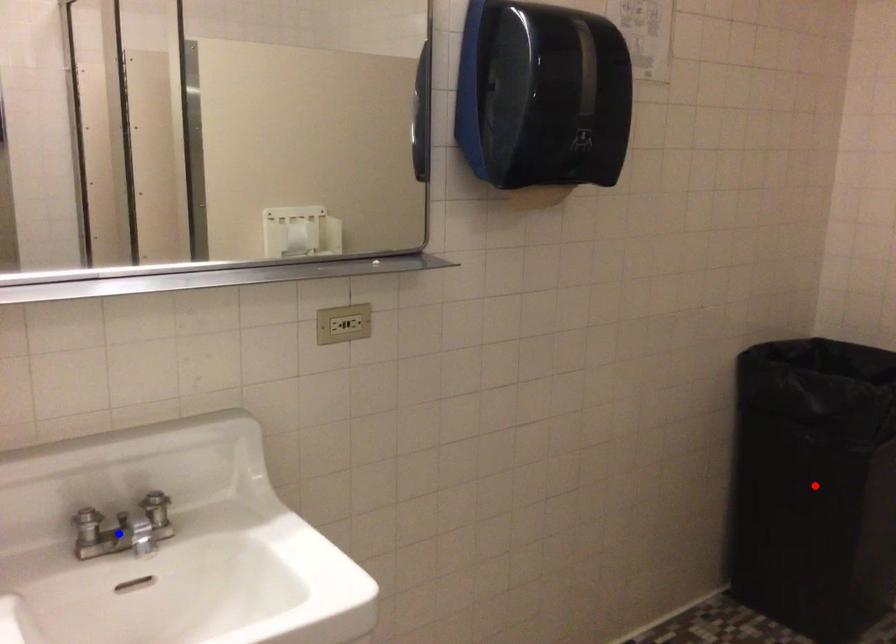
Question: Which of the two points in the image is closer to the camera?

Choices:
 (A) Blue point is closer.
 (B) Red point is closer.

Answer: (A)